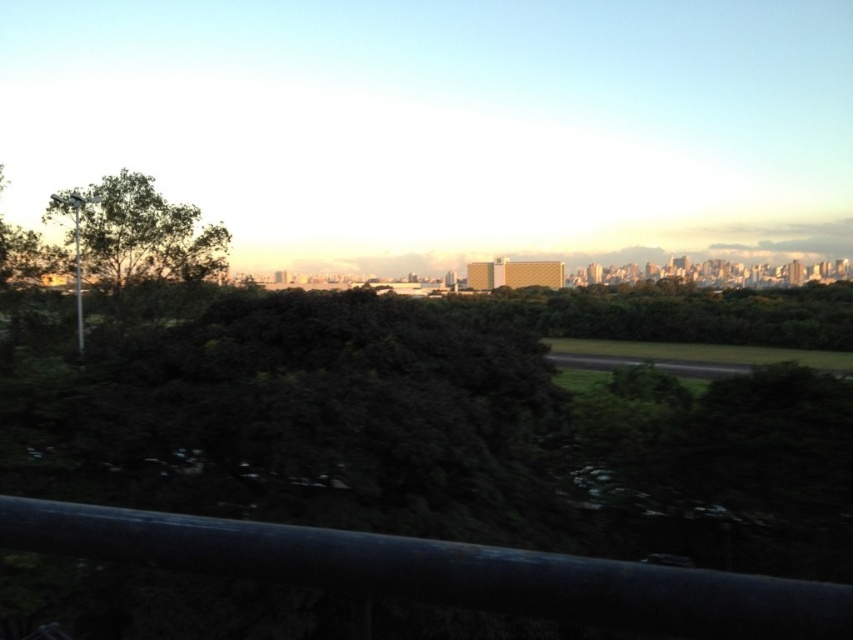
Does black metal rail at lower center lie in front of green leafy tree at left?

Yes.

Where is `black metal rail at lower center`? black metal rail at lower center is located at coordinates (440, 572).